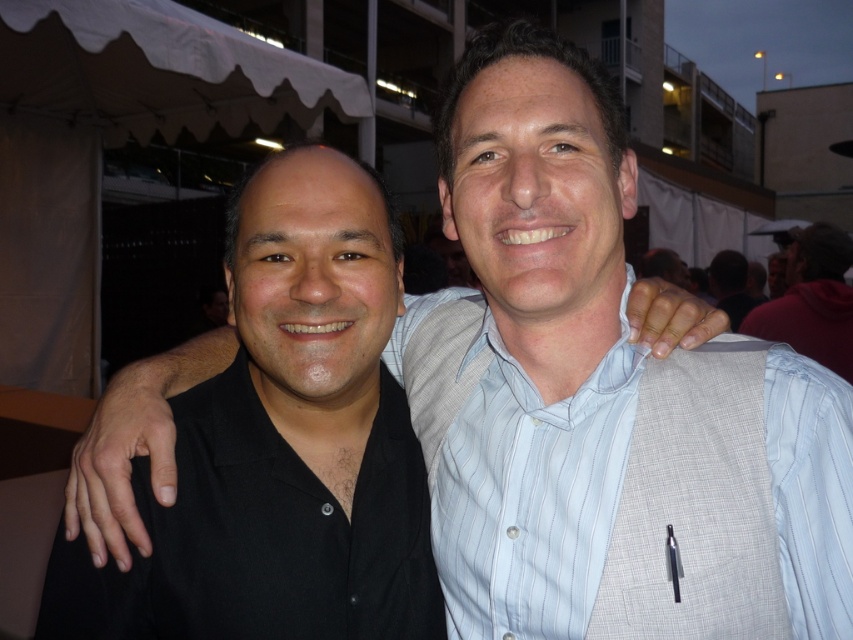
Can you confirm if light blue striped shirt at center is bigger than white striped shirt at upper right?

Incorrect, light blue striped shirt at center is not larger than white striped shirt at upper right.

Looking at this image, is light blue striped shirt at center positioned in front of white striped shirt at upper right?

That is True.

The width and height of the screenshot is (853, 640). Find the location of `light blue striped shirt at center`. light blue striped shirt at center is located at coordinates (531, 493).

Find the location of a particular element. light blue striped shirt at center is located at coordinates (531, 493).